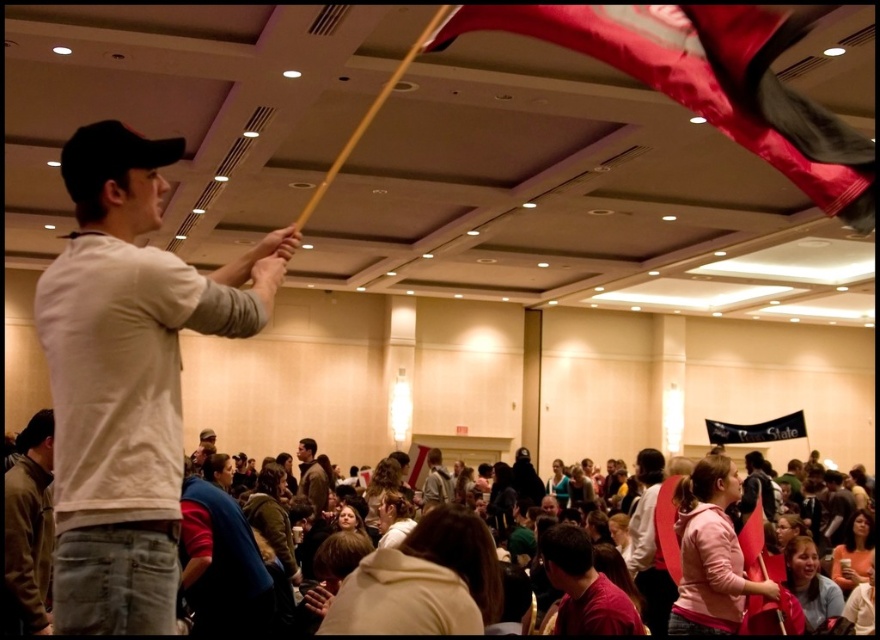
Question: Which object appears closest to the camera in this image?

Choices:
 (A) dark brown leather jacket at lower left
 (B) black fabric banner at upper center
 (C) white matte shirt at center
 (D) red fabric flag at upper right

Answer: (C)

Question: Based on their relative distances, which object is nearer to the light brown leather jacket at center?

Choices:
 (A) black fabric banner at upper center
 (B) dark brown leather jacket at lower left

Answer: (B)

Question: Which object is closer to the camera taking this photo?

Choices:
 (A) brown leather jacket at center
 (B) dark brown leather jacket at lower left

Answer: (B)

Question: Is the position of brown leather jacket at center more distant than that of light brown leather jacket at center?

Choices:
 (A) no
 (B) yes

Answer: (B)

Question: Where is white matte shirt at center located in relation to black fabric banner at upper center in the image?

Choices:
 (A) above
 (B) below

Answer: (A)

Question: Does dark brown leather jacket at lower left appear over brown leather jacket at center?

Choices:
 (A) no
 (B) yes

Answer: (B)